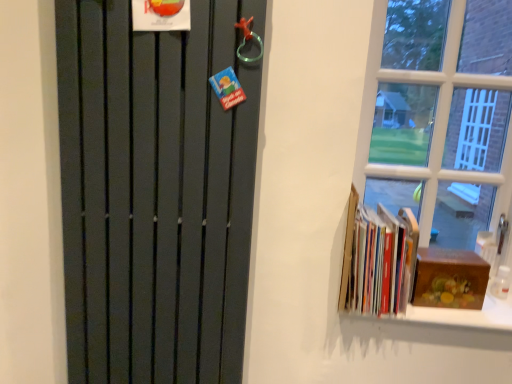
Question: Is hardcover books at right facing towards matte black radiator at left?

Choices:
 (A) yes
 (B) no

Answer: (B)

Question: Is hardcover books at right to the left of matte black radiator at left from the viewer's perspective?

Choices:
 (A) no
 (B) yes

Answer: (A)

Question: Is hardcover books at right not inside matte black radiator at left?

Choices:
 (A) no
 (B) yes

Answer: (B)

Question: Is matte black radiator at left completely or partially inside hardcover books at right?

Choices:
 (A) no
 (B) yes

Answer: (A)

Question: Does hardcover books at right have a lesser width compared to matte black radiator at left?

Choices:
 (A) yes
 (B) no

Answer: (B)

Question: From a real-world perspective, is hardcover books at right physically located above or below wooden box at right?

Choices:
 (A) above
 (B) below

Answer: (A)

Question: Considering the positions of hardcover books at right and wooden box at right in the image, is hardcover books at right bigger or smaller than wooden box at right?

Choices:
 (A) small
 (B) big

Answer: (B)

Question: From the image's perspective, is hardcover books at right positioned above or below wooden box at right?

Choices:
 (A) below
 (B) above

Answer: (B)

Question: Do you think hardcover books at right is within wooden box at right, or outside of it?

Choices:
 (A) inside
 (B) outside

Answer: (B)

Question: Based on their sizes in the image, would you say wooden box at right is bigger or smaller than matte black radiator at left?

Choices:
 (A) big
 (B) small

Answer: (B)

Question: Is wooden box at right wider or thinner than matte black radiator at left?

Choices:
 (A) thin
 (B) wide

Answer: (B)

Question: Considering the positions of wooden box at right and matte black radiator at left in the image, is wooden box at right taller or shorter than matte black radiator at left?

Choices:
 (A) short
 (B) tall

Answer: (A)

Question: Which is correct: wooden box at right is inside matte black radiator at left, or outside of it?

Choices:
 (A) inside
 (B) outside

Answer: (B)

Question: Based on their sizes in the image, would you say hardcover books at right is bigger or smaller than matte black radiator at left?

Choices:
 (A) small
 (B) big

Answer: (A)

Question: Is hardcover books at right inside the boundaries of matte black radiator at left, or outside?

Choices:
 (A) inside
 (B) outside

Answer: (B)